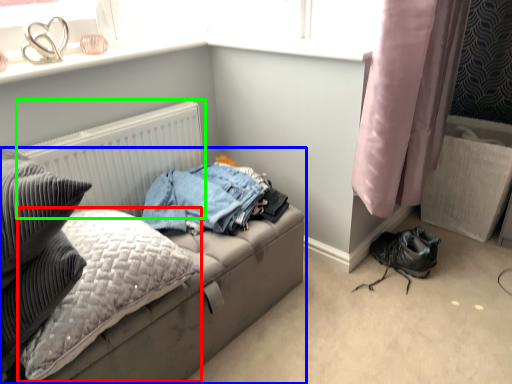
Question: Which object is the closest to the pillow (highlighted by a red box)? Choose among these: studio couch (highlighted by a blue box) or radiator (highlighted by a green box).

Choices:
 (A) studio couch
 (B) radiator

Answer: (A)